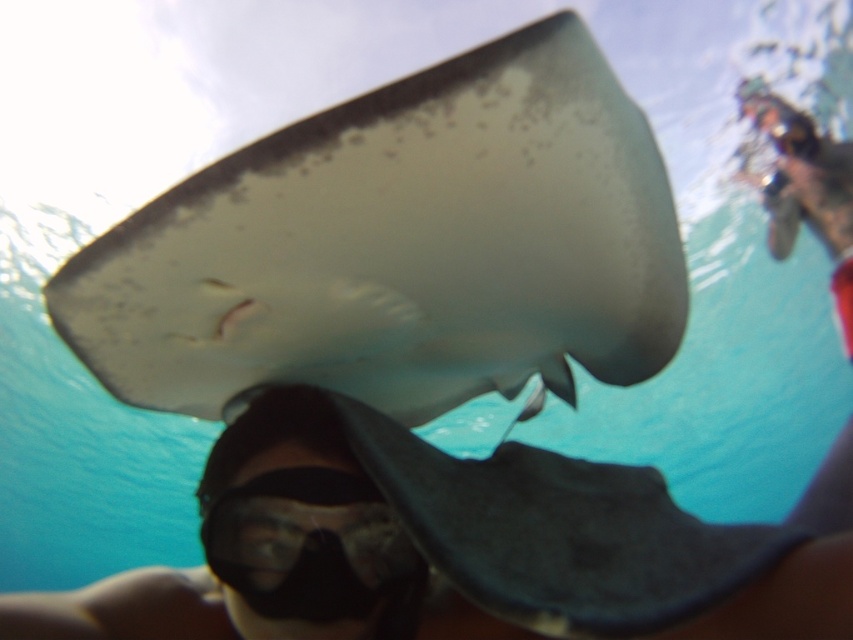
Based on the coordinates provided, what object is located at point (399, 248) in the underwater scene?

The point (399, 248) indicates the location of the smooth white stingray at center.

You are an underwater photographer aiming to capture the smooth white stingray at center and the black matte goggles at lower center in the same frame. Based on their sizes, which object should you focus on first to ensure both fit in the photo?

The smooth white stingray at center is larger than the black matte goggles at lower center. To ensure both fit in the photo, focus on the larger object first, which is the smooth white stingray at center.